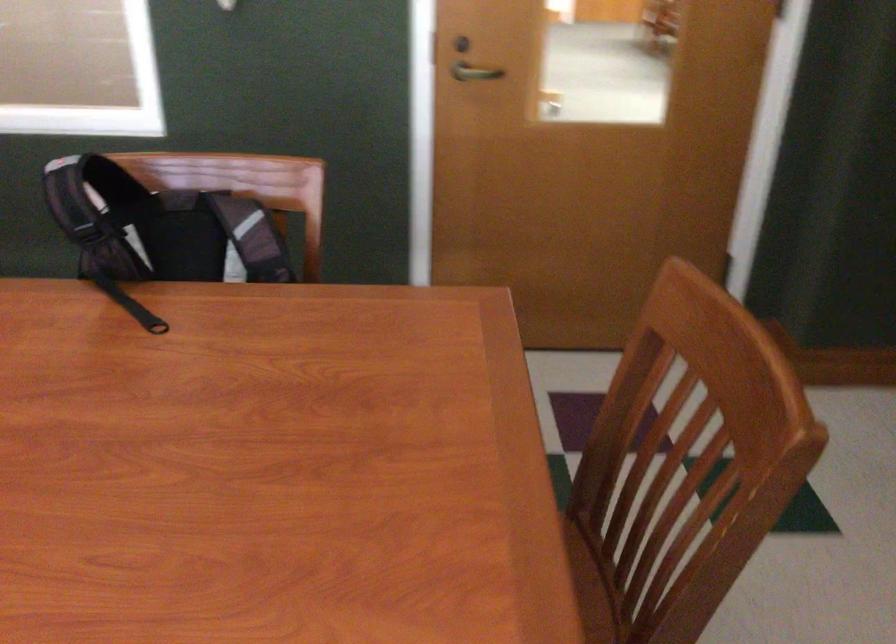
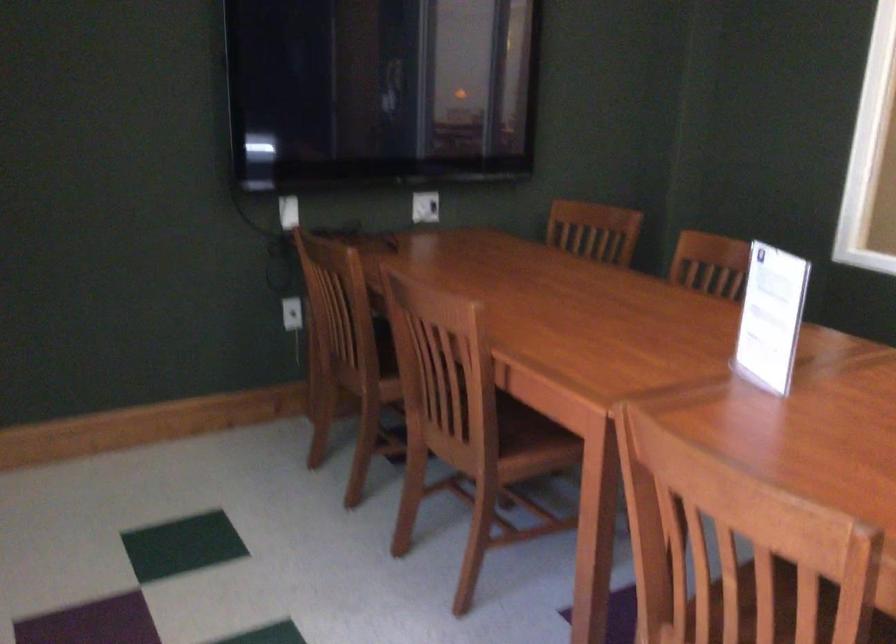
Question: How did the camera likely rotate?

Choices:
 (A) Left
 (B) Right
 (C) Up
 (D) Down

Answer: (A)